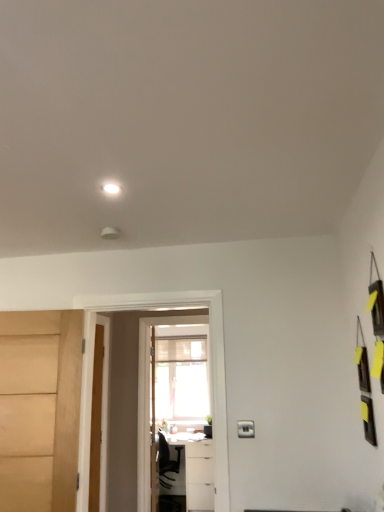
Question: Considering their positions, is wooden door at center, the 2th door positioned from the left, located in front of or behind white glossy table at lower center?

Choices:
 (A) front
 (B) behind

Answer: (A)

Question: Considering the positions of wooden door at center, arranged as the second door when viewed from the back, and white glossy table at lower center in the image, is wooden door at center, arranged as the second door when viewed from the back, bigger or smaller than white glossy table at lower center?

Choices:
 (A) big
 (B) small

Answer: (B)

Question: Estimate the real-world distances between objects in this image. Which object is farther from the wooden door at center, marked as the 3th door in a left-to-right arrangement?

Choices:
 (A) matte wood door at left, placed as the 1th door when sorted from front to back
 (B) wooden door at center, the second door when ordered from right to left
 (C) white glossy light at upper center
 (D) white glossy table at lower center
 (E) transparent glass screen door at center

Answer: (C)

Question: Based on their relative distances, which object is farther from the wooden door at center, the 2th door positioned from the left?

Choices:
 (A) white glossy light at upper center
 (B) wooden door at center, the 3th door in the front-to-back sequence
 (C) matte wood door at left, which appears as the 1th door when viewed from the left
 (D) transparent glass screen door at center
 (E) white glossy table at lower center

Answer: (A)